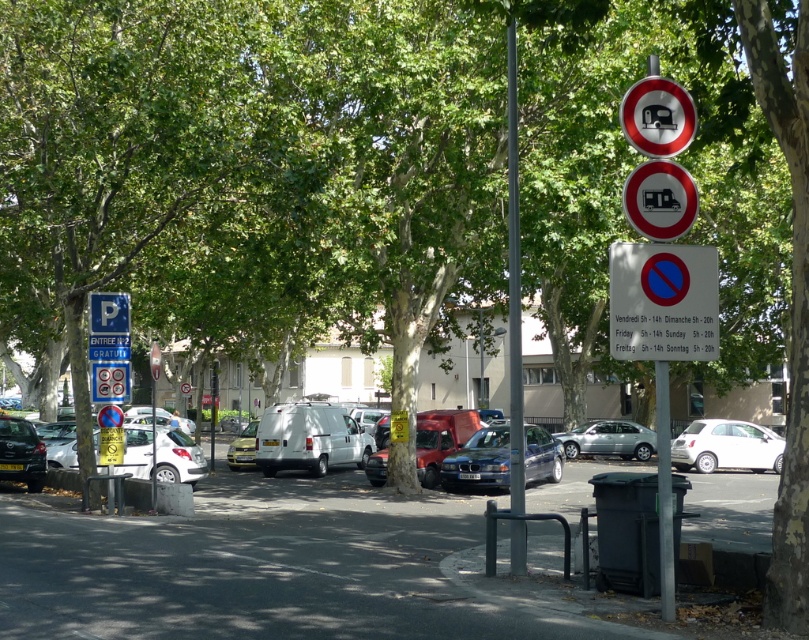
Question: Can you confirm if white matte car at center is smaller than matte black truck at upper center?

Choices:
 (A) yes
 (B) no

Answer: (A)

Question: Does metallic blue sedan at center have a smaller size compared to white matte car at center?

Choices:
 (A) yes
 (B) no

Answer: (A)

Question: Does white matte van at center appear under silver metallic hatchback at left?

Choices:
 (A) no
 (B) yes

Answer: (A)

Question: Which is farther from the white plastic sign at center?

Choices:
 (A) silver metallic pole at center
 (B) metallic silver van at center
 (C) gray metallic pole at center

Answer: (B)

Question: Among these points, which one is nearest to the camera?

Choices:
 (A) (251, 433)
 (B) (547, 444)

Answer: (B)

Question: Which point is closer to the camera?

Choices:
 (A) (532, 474)
 (B) (365, 435)
 (C) (255, 419)
 (D) (650, 273)

Answer: (D)